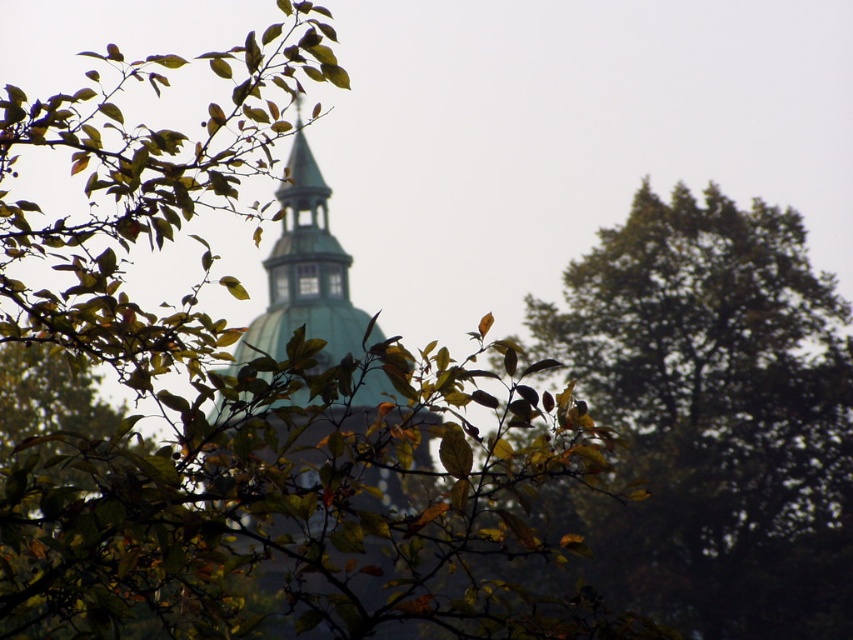
In the scene shown: Does green leafy tree at upper right have a greater width compared to green copper dome at center?

Yes.

Who is shorter, green leafy tree at upper right or green copper dome at center?

green leafy tree at upper right is shorter.

The width and height of the screenshot is (853, 640). I want to click on green leafy tree at upper right, so click(x=715, y=413).